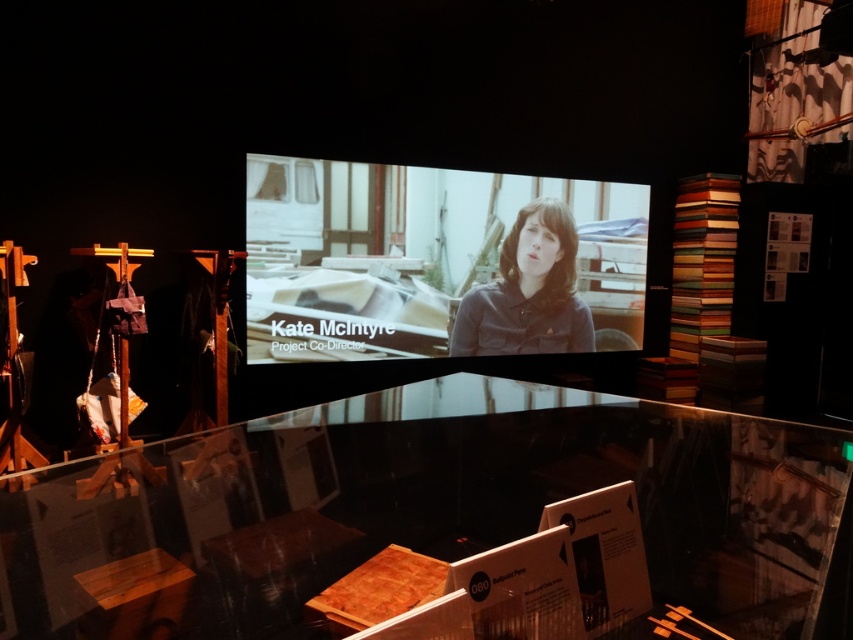
You are an event planner setting up for a presentation. You need to place a 1.2 meter wide banner between the transparent glass table at center and the matte brown shirt at center. Is there enough space between them to fit the banner?

The transparent glass table at center is larger in size than the matte brown shirt at center, but the exact distance between them isn

You are an event planner setting up a photo shoot in this room. You need to position a 1.5m tall tripod between the matte black screen at center and the matte brown shirt at center. Given their height difference, will the tripod be taller than both objects when placed there?

The matte black screen at center is much taller than the matte brown shirt at center. Since the screen is already much taller than the shirt, and the tripod is 1.5m tall, it depends on the actual height of the screen. However, the description only states the screen is taller than the shirt but doesn